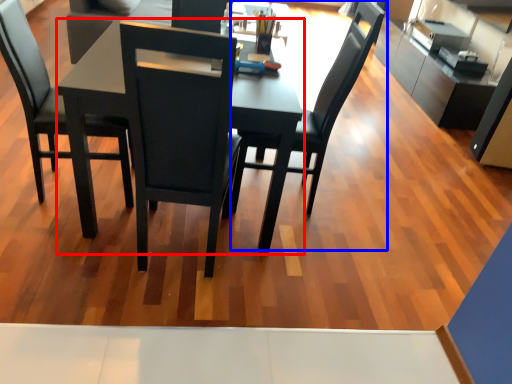
Question: Among these objects, which one is farthest to the camera, round table (highlighted by a red box) or chair (highlighted by a blue box)?

Choices:
 (A) round table
 (B) chair

Answer: (B)